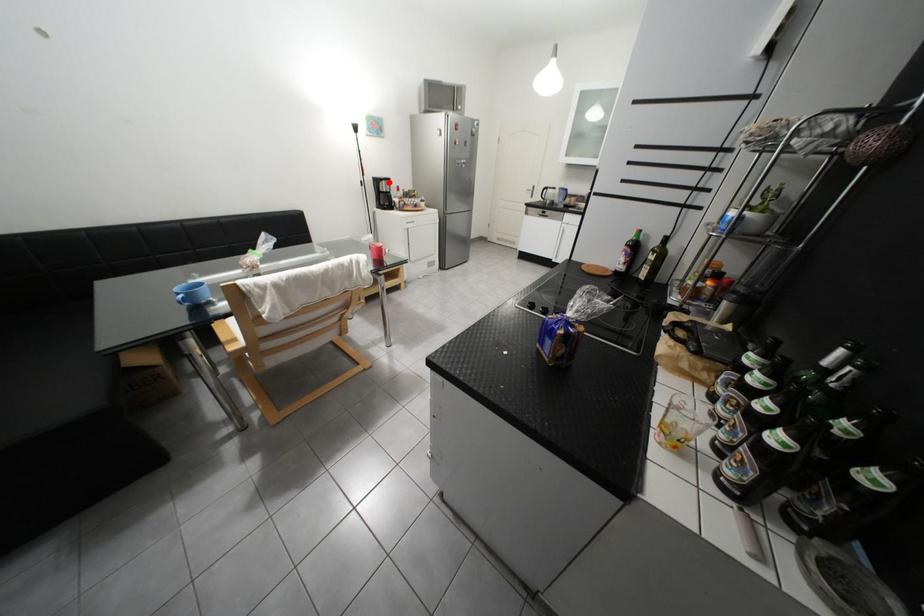
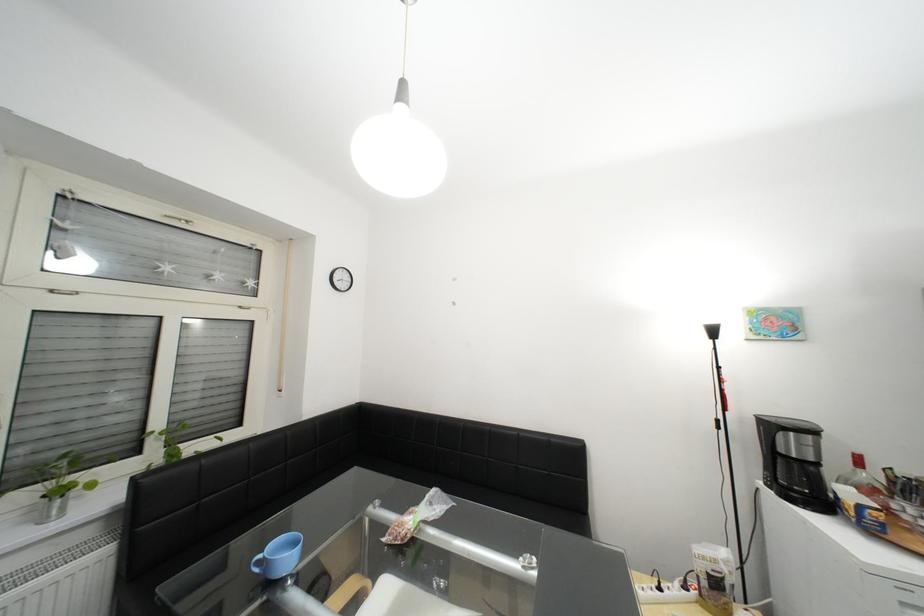
The point at the highlighted location is marked in the first image. Where is the corresponding point in the second image?

(782, 428)